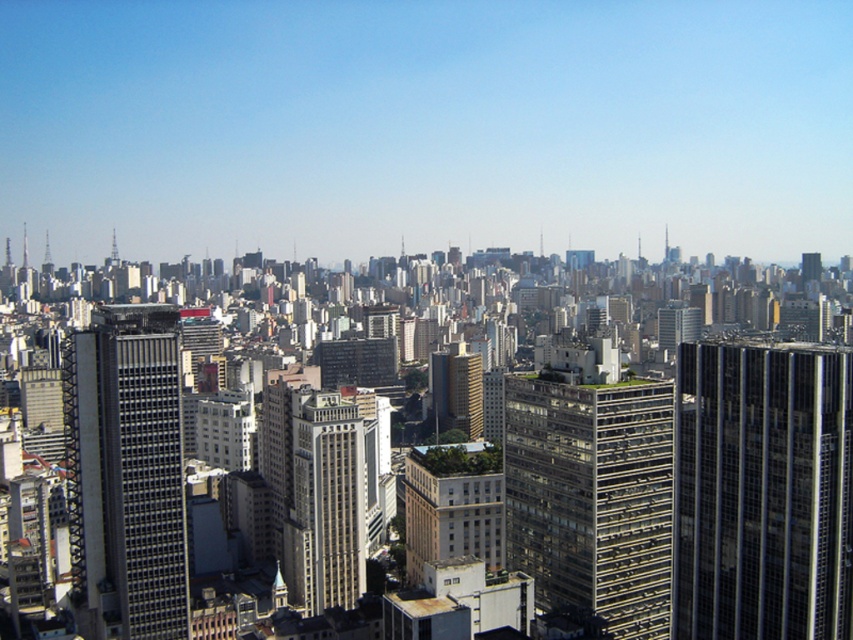
Question: Is black glass skyscraper at right above matte glass skyscraper at center-left?

Choices:
 (A) no
 (B) yes

Answer: (A)

Question: Which object is positioned closest to the matte glass skyscraper at center-left?

Choices:
 (A) glassy concrete skyscraper at center
 (B) white concrete building at center
 (C) black glass skyscraper at right

Answer: (B)

Question: Is glassy concrete skyscraper at center below white concrete building at center?

Choices:
 (A) no
 (B) yes

Answer: (A)

Question: Which of the following is the farthest from the observer?

Choices:
 (A) black glass skyscraper at right
 (B) matte glass skyscraper at center-left
 (C) white concrete building at center
 (D) glassy concrete skyscraper at center

Answer: (C)

Question: Which point appears closest to the camera in this image?

Choices:
 (A) (645, 577)
 (B) (415, 502)

Answer: (A)

Question: Considering the relative positions of glassy concrete skyscraper at center and beige stone building at center in the image provided, where is glassy concrete skyscraper at center located with respect to beige stone building at center?

Choices:
 (A) right
 (B) left

Answer: (A)